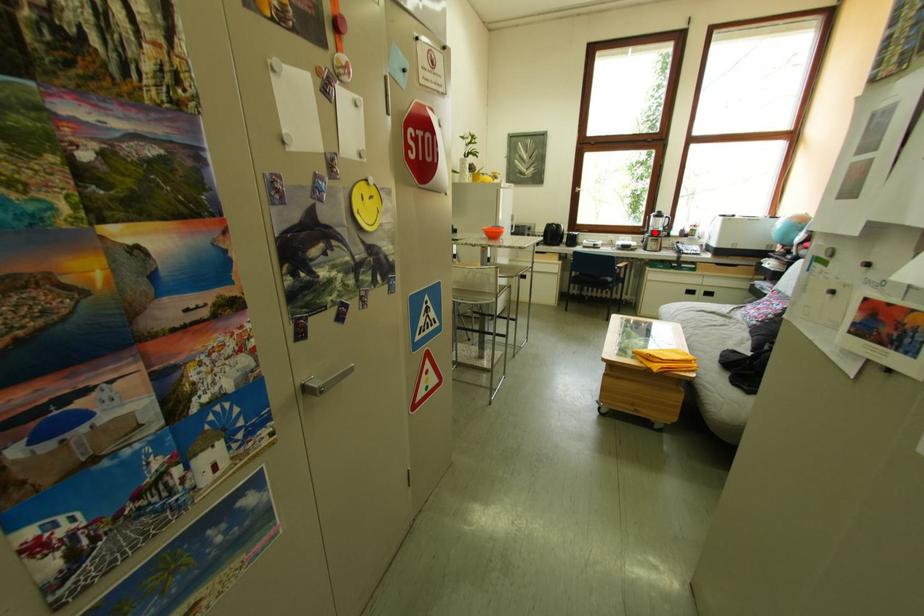
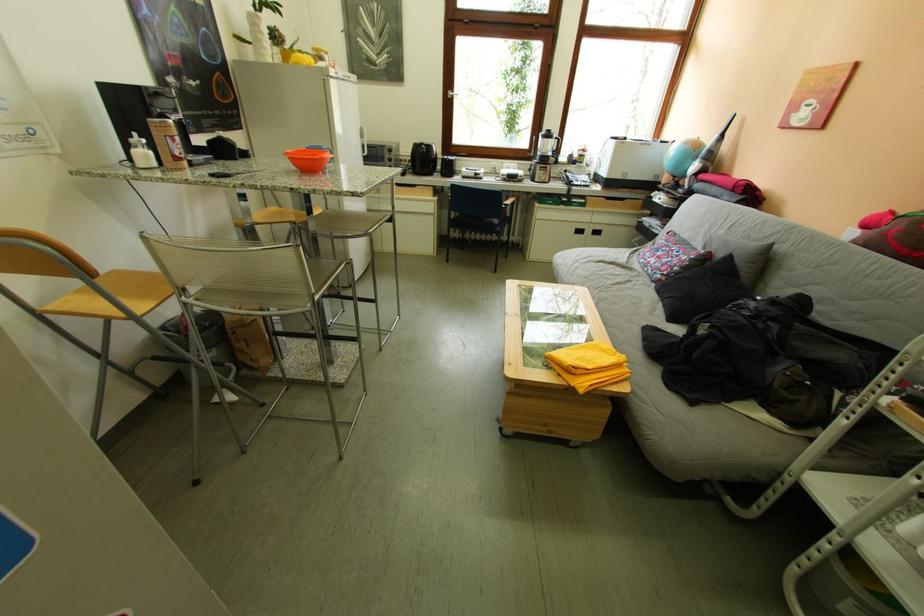
Locate, in the second image, the point that corresponds to the highlighted location in the first image.

(541, 156)